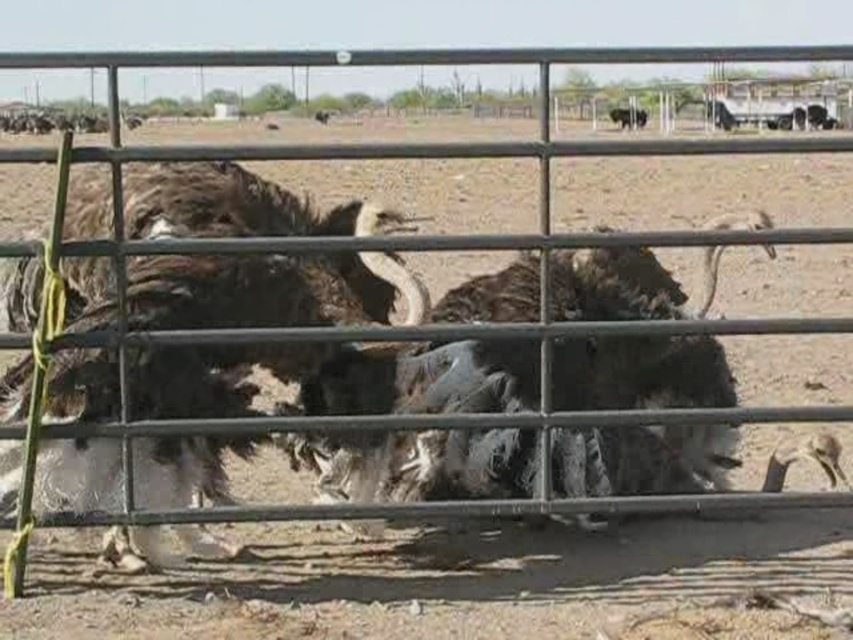
Question: Is shiny black car at upper right to the right of brown fuzzy bison at upper right from the viewer's perspective?

Choices:
 (A) yes
 (B) no

Answer: (A)

Question: Which point is closer to the camera?

Choices:
 (A) fuzzy brown bison at center
 (B) brown fuzzy bison at upper right

Answer: (A)

Question: Which point is closer to the camera?

Choices:
 (A) fuzzy brown bison at center
 (B) shiny black car at upper right
 (C) brown fuzzy bison at upper right

Answer: (A)

Question: Does fuzzy brown bison at center appear on the left side of brown fuzzy bison at upper right?

Choices:
 (A) yes
 (B) no

Answer: (A)

Question: Which point appears closest to the camera in this image?

Choices:
 (A) (723, 108)
 (B) (634, 112)
 (C) (254, 282)

Answer: (C)

Question: Observing the image, what is the correct spatial positioning of fuzzy brown bison at center in reference to shiny black car at upper right?

Choices:
 (A) below
 (B) above

Answer: (A)